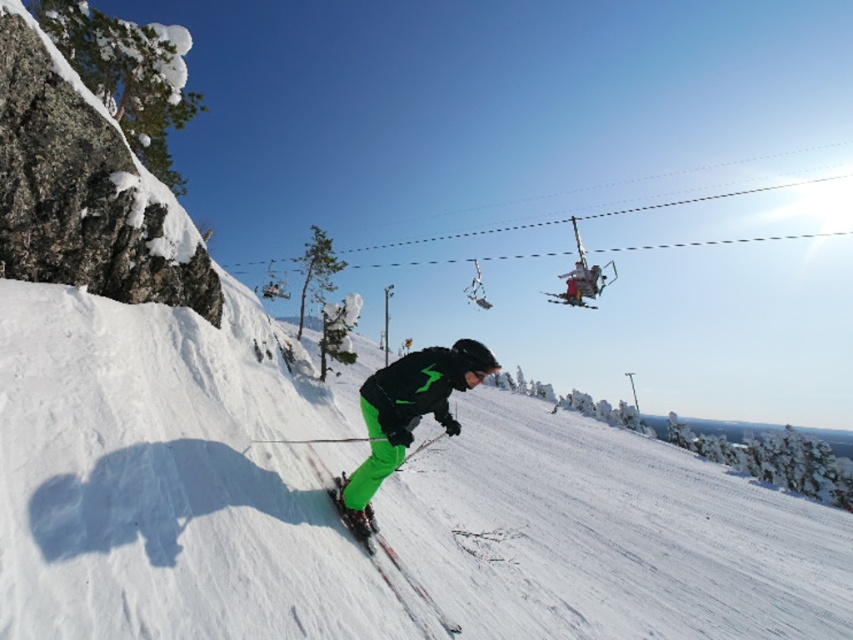
You are navigating a drone through a winter ski resort scene. You need to fly from point A to point B. The coordinates for point A are point (608, 513) and point B are point (379, 476). Considering the slope and obstacles, will your drone pass behind or in front of the skier during its flight path?

Point (608, 513) is behind point (379, 476), so the drone will pass behind the skier during its flight path.

You are a photographer planning to capture the skier in action. Given that the green matte ski slope at center and the green matte snow pants at center are both in the frame, which object would appear taller in the photograph?

The green matte ski slope at center appears taller than the green matte snow pants at center in the photograph because the ski slope has a greater height compared to the snow pants.

You are a photographer trying to capture a clear shot of both the green matte snow pants at center and the green matte ski at center. Since you want both objects in focus, you need to know their positions relative to each other. Which object is closer to the camera?

The green matte snow pants at center is in front of the green matte ski at center, so it is closer to the camera.